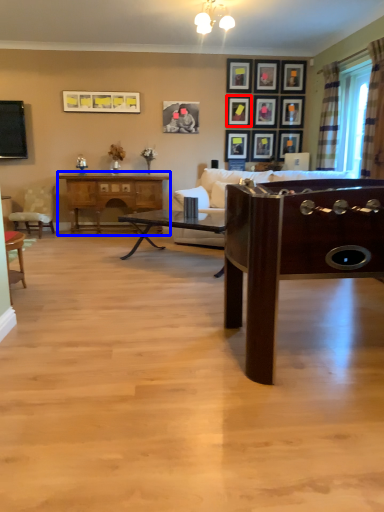
Question: Which object appears farthest to the camera in this image, picture frame (highlighted by a red box) or desk (highlighted by a blue box)?

Choices:
 (A) picture frame
 (B) desk

Answer: (A)